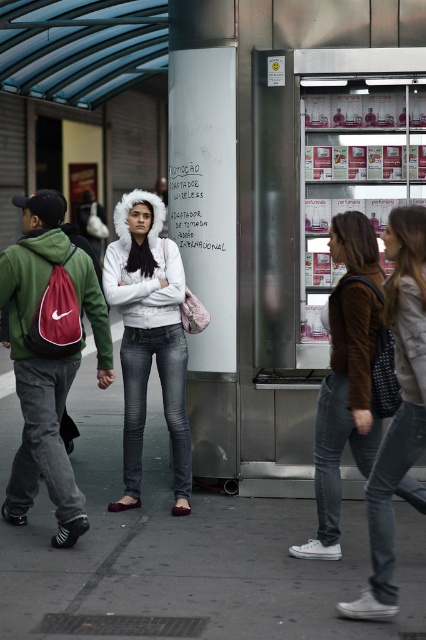
Does red fabric backpack at left appear on the right side of white fur-lined jacket at center?

No, red fabric backpack at left is not to the right of white fur-lined jacket at center.

Is red fabric backpack at left to the left of white fur-lined jacket at center from the viewer's perspective?

Yes, red fabric backpack at left is to the left of white fur-lined jacket at center.

Where is `red fabric backpack at left`? red fabric backpack at left is located at coordinates (48, 355).

Does smooth concrete pavement at center have a greater width compared to white fur-lined jacket at center?

Yes.

The width and height of the screenshot is (426, 640). In order to click on smooth concrete pavement at center in this screenshot , I will do `click(187, 554)`.

Which is in front, point (265, 554) or point (181, 369)?

Point (265, 554) is more forward.

Locate an element on the screen. This screenshot has width=426, height=640. smooth concrete pavement at center is located at coordinates (187, 554).

Does point (356, 552) lie in front of point (379, 268)?

No, it is behind (379, 268).

Between point (118, 604) and point (330, 400), which one is positioned in front?

Positioned in front is point (118, 604).

Is point (101, 547) less distant than point (362, 429)?

That is False.

This screenshot has width=426, height=640. Identify the location of smooth concrete pavement at center. point(187,554).